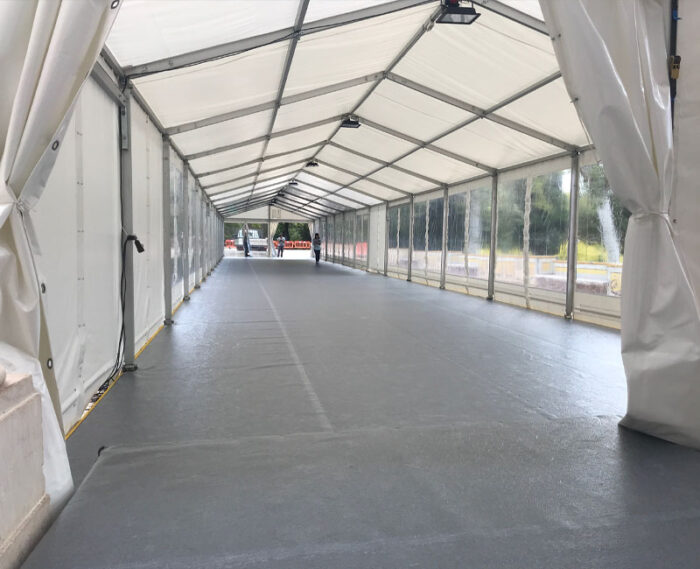
Locate an element on the screen. Image resolution: width=700 pixels, height=569 pixels. canvas drape tie-back is located at coordinates (29, 226), (663, 214).